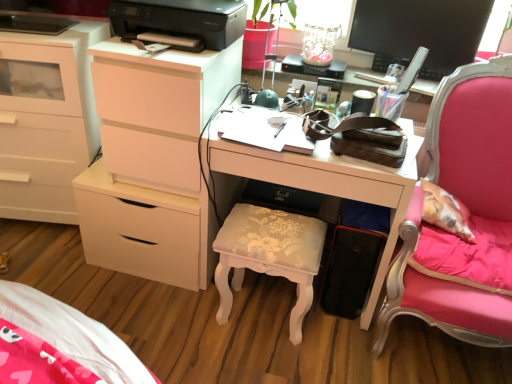
Question: Does white glossy desk at center have a larger size compared to white matte chest of drawers at left, marked as the second chest of drawers in a right-to-left arrangement?

Choices:
 (A) yes
 (B) no

Answer: (B)

Question: Could you tell me if white glossy desk at center is facing white matte chest of drawers at left, marked as the second chest of drawers in a right-to-left arrangement?

Choices:
 (A) no
 (B) yes

Answer: (A)

Question: From a real-world perspective, is white glossy desk at center positioned over white matte chest of drawers at left, marked as the second chest of drawers in a right-to-left arrangement, based on gravity?

Choices:
 (A) yes
 (B) no

Answer: (B)

Question: Can you confirm if white glossy desk at center is smaller than white matte chest of drawers at left, marked as the second chest of drawers in a right-to-left arrangement?

Choices:
 (A) yes
 (B) no

Answer: (A)

Question: Does white glossy desk at center appear on the left side of white matte chest of drawers at left, the first chest of drawers in the left-to-right sequence?

Choices:
 (A) no
 (B) yes

Answer: (A)

Question: Does white glossy desk at center come in front of white matte chest of drawers at left, marked as the second chest of drawers in a right-to-left arrangement?

Choices:
 (A) yes
 (B) no

Answer: (A)

Question: Considering the relative sizes of black plastic printer at upper center and white glossy desk at center in the image provided, is black plastic printer at upper center thinner than white glossy desk at center?

Choices:
 (A) no
 (B) yes

Answer: (A)

Question: Is black plastic printer at upper center aimed at white glossy desk at center?

Choices:
 (A) no
 (B) yes

Answer: (A)

Question: From the image's perspective, would you say black plastic printer at upper center is shown under white glossy desk at center?

Choices:
 (A) yes
 (B) no

Answer: (B)

Question: Is black plastic printer at upper center oriented away from white glossy desk at center?

Choices:
 (A) yes
 (B) no

Answer: (B)

Question: Does black plastic printer at upper center contain white glossy desk at center?

Choices:
 (A) yes
 (B) no

Answer: (B)

Question: Can you confirm if black plastic printer at upper center is wider than white glossy desk at center?

Choices:
 (A) no
 (B) yes

Answer: (B)

Question: From a real-world perspective, is white matte chest of drawers at left, marked as the second chest of drawers in a right-to-left arrangement, located higher than black plastic printer at upper center?

Choices:
 (A) no
 (B) yes

Answer: (A)